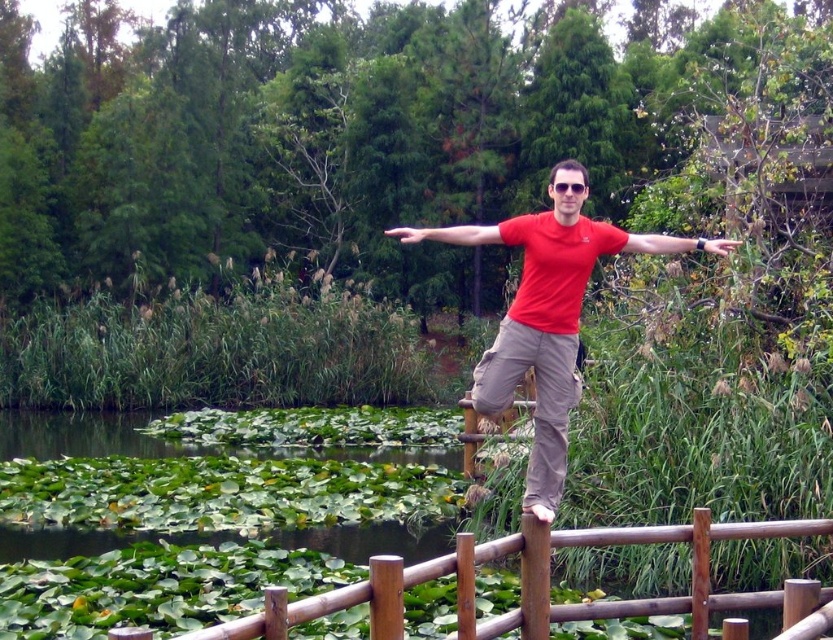
Does brown wooden rail at center have a smaller size compared to red matte shirt at center?

Yes.

Which is behind, point (541, 525) or point (562, 380)?

Positioned behind is point (562, 380).

Is point (525, 538) positioned after point (536, 298)?

That is False.

Locate an element on the screen. The image size is (833, 640). brown wooden rail at center is located at coordinates (542, 584).